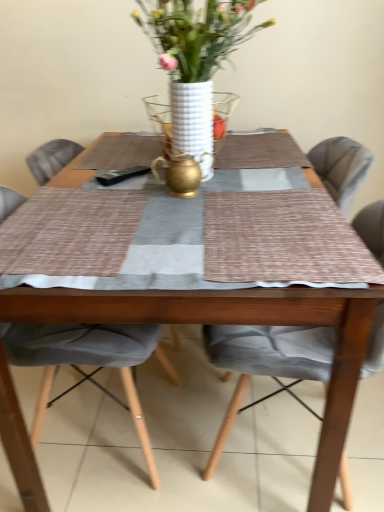
Where is `space that is in front of white textured vase at center`? space that is in front of white textured vase at center is located at coordinates (211, 175).